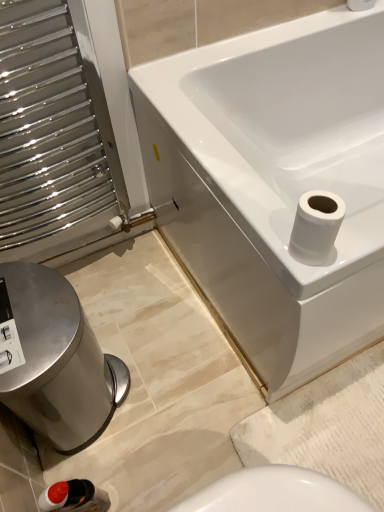
Find the location of a particular element. This screenshot has width=384, height=512. vacant location behind polished stainless steel bidet at lower left is located at coordinates (120, 309).